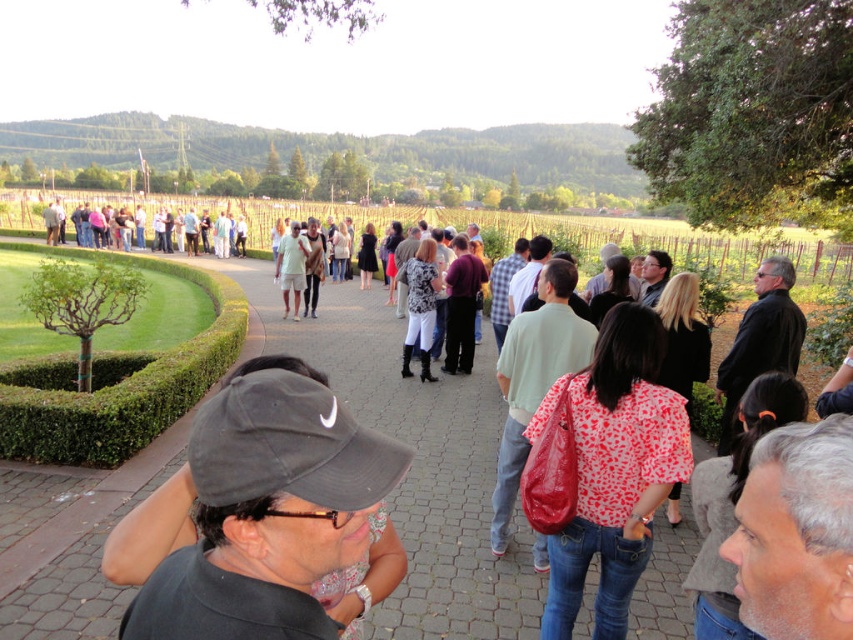
Question: Does red fabric bag at center appear on the right side of black fabric cap at center?

Choices:
 (A) yes
 (B) no

Answer: (A)

Question: Among these points, which one is farthest from the camera?

Choices:
 (A) coord(570,380)
 (B) coord(372,586)
 (C) coord(78,426)
 (D) coord(258,228)

Answer: (D)

Question: From the image, what is the correct spatial relationship of red fabric bag at center in relation to black fabric cap at center?

Choices:
 (A) below
 (B) above

Answer: (A)

Question: Does red fabric bag at center appear on the right side of green leafy hedge at lower left?

Choices:
 (A) yes
 (B) no

Answer: (A)

Question: Which of these objects is positioned farthest from the green leafy hedge at lower left?

Choices:
 (A) black fabric cap at center
 (B) matte black jacket at center
 (C) red fabric bag at center

Answer: (B)

Question: Which of the following is the farthest from the observer?

Choices:
 (A) (154, 547)
 (B) (572, 522)
 (C) (200, 237)

Answer: (C)